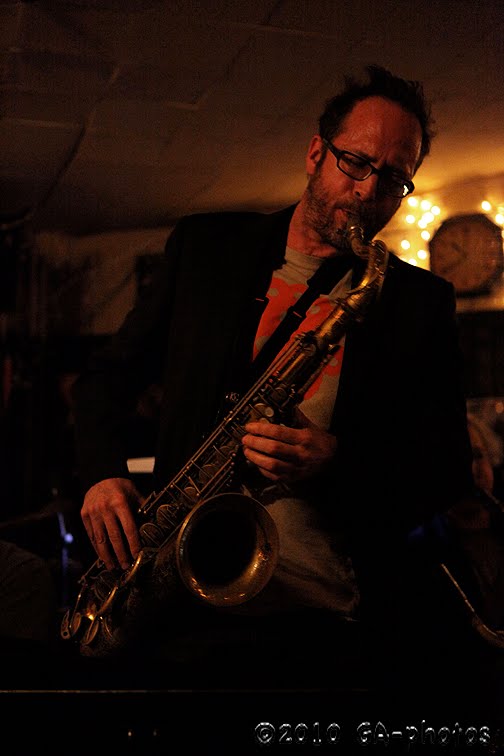
The height and width of the screenshot is (756, 504). Find the location of `ceiling`. ceiling is located at coordinates (158, 79).